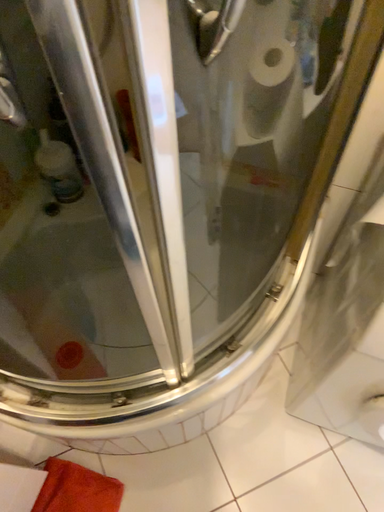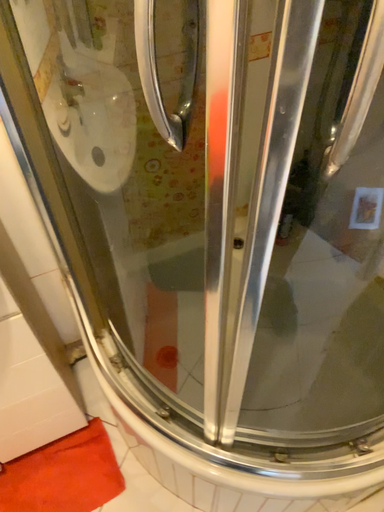
Question: How did the camera likely rotate when shooting the video?

Choices:
 (A) rotated left
 (B) rotated right

Answer: (A)